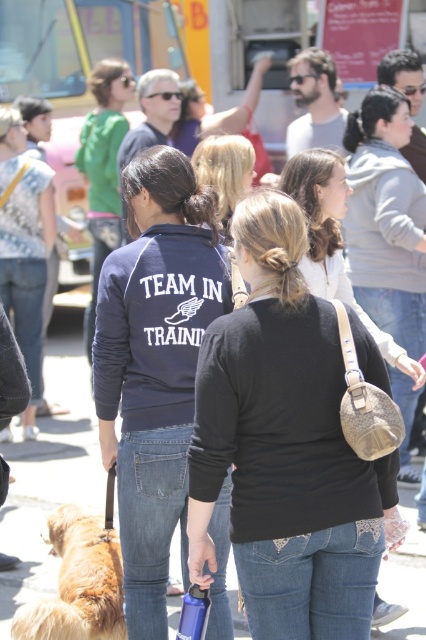
Question: Which of the following is the farthest from the observer?

Choices:
 (A) (141, 596)
 (B) (106, 564)
 (C) (201, 611)
 (D) (359, 244)

Answer: (D)

Question: Can you confirm if golden fur dog at lower left is bigger than blue matte water bottle at lower center?

Choices:
 (A) yes
 (B) no

Answer: (A)

Question: Does black matte sweater at center appear under leather beige purse at center?

Choices:
 (A) yes
 (B) no

Answer: (A)

Question: Which point is closer to the camera taking this photo?

Choices:
 (A) (229, 157)
 (B) (363, 237)
 (C) (193, 604)

Answer: (C)

Question: Is golden fur dog at lower left below blue matte water bottle at lower center?

Choices:
 (A) no
 (B) yes

Answer: (B)

Question: Which object is the farthest from the leather beige purse at center?

Choices:
 (A) blue matte water bottle at lower center
 (B) navy blue fleece at center
 (C) blonde hair at center

Answer: (A)